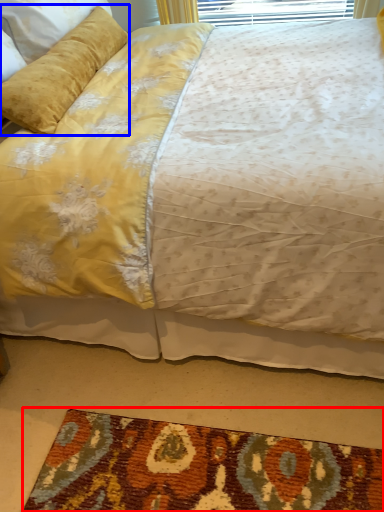
Question: Which object appears farthest to the camera in this image, mat (highlighted by a red box) or pillow (highlighted by a blue box)?

Choices:
 (A) mat
 (B) pillow

Answer: (B)